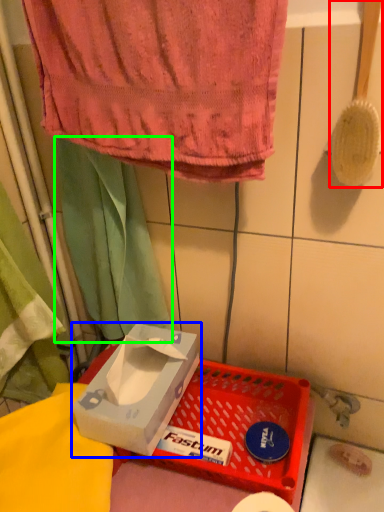
Question: Which object is positioned closest to brush (highlighted by a red box)? Select from box (highlighted by a blue box) and curtain (highlighted by a green box).

Choices:
 (A) box
 (B) curtain

Answer: (B)